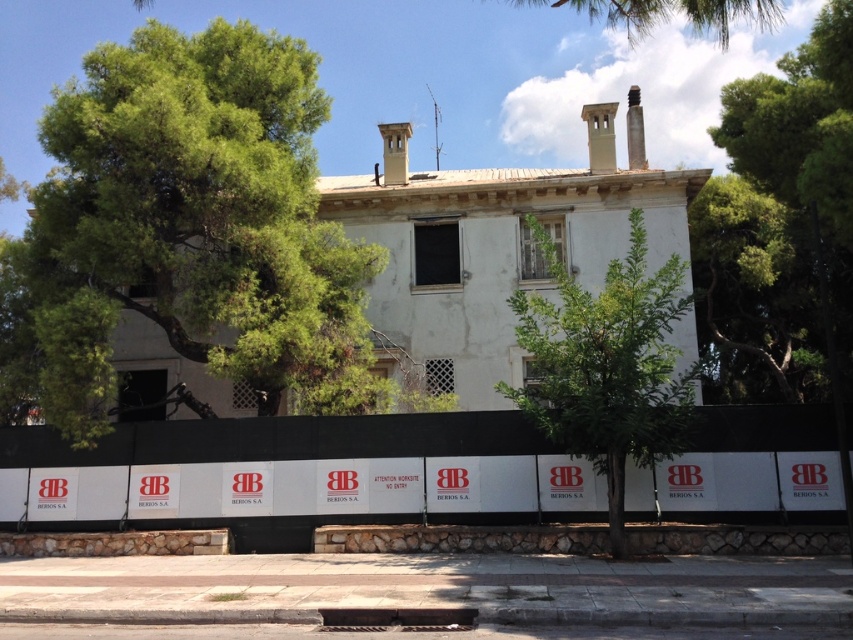
You are standing at the camera position facing the two story building. There is a green leafy tree at left. You want to walk to the tree. Can you walk straight ahead from your current position to reach the tree?

The distance between the green leafy tree at left and the camera is 13.19 meters. Since you are at the camera position, you can walk straight ahead towards the tree as there is no mentioned obstacle in the scene description. The construction barrier is in front of the building, not blocking the path to the tree.

You are standing in front of the two story building and want to take a photo of the green leafy tree at upper right and the green leafy tree at center. Which tree should you focus on first to ensure both are in frame?

You should focus on the green leafy tree at upper right first because it is closer to you than the green leafy tree at center, so adjusting the camera to include both would require framing starting from the closer one.